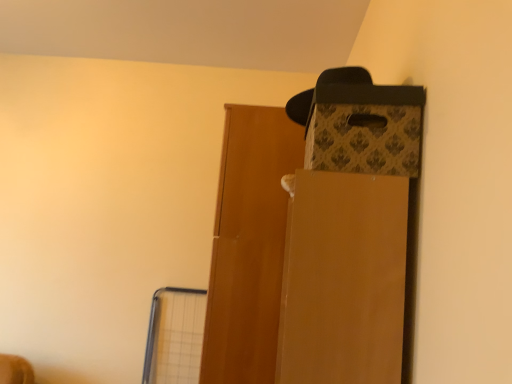
Question: Which is correct: wooden door at center is inside matte brown cardboard box at upper right, or outside of it?

Choices:
 (A) inside
 (B) outside

Answer: (B)

Question: Is wooden door at center bigger or smaller than matte brown cardboard box at upper right?

Choices:
 (A) small
 (B) big

Answer: (B)

Question: Which object is positioned closest to the matte brown cardboard box at upper right?

Choices:
 (A) patterned cardboard box at upper right
 (B) wooden door at center

Answer: (A)

Question: Based on their relative distances, which object is nearer to the patterned cardboard box at upper right?

Choices:
 (A) wooden door at center
 (B) matte brown cardboard box at upper right

Answer: (B)